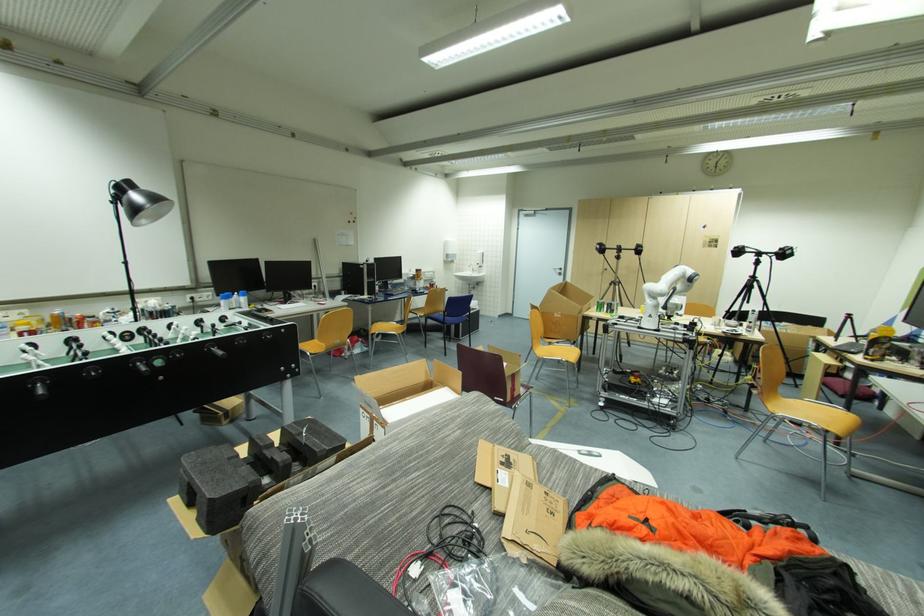
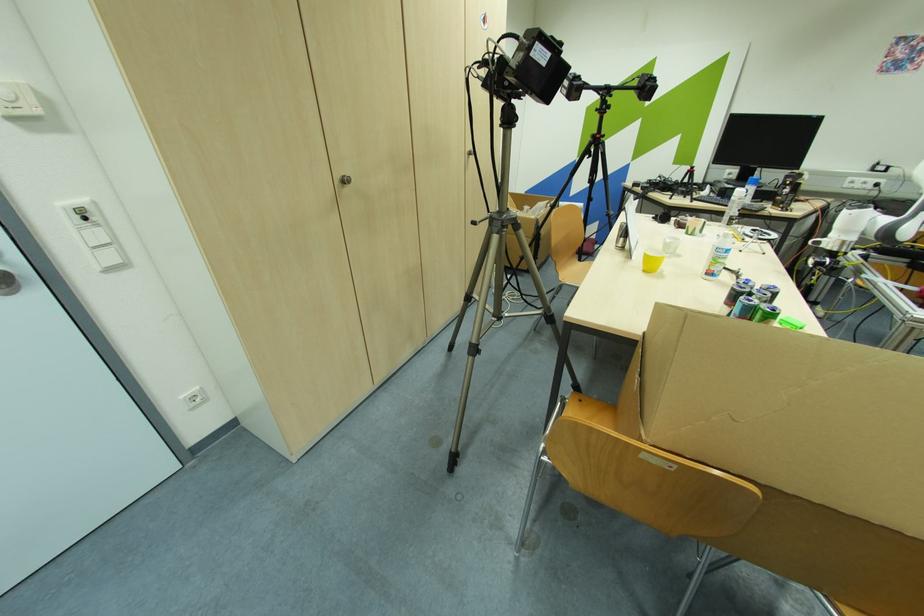
In the second image, find the point that corresponds to point 609,270 in the first image.

(348, 182)